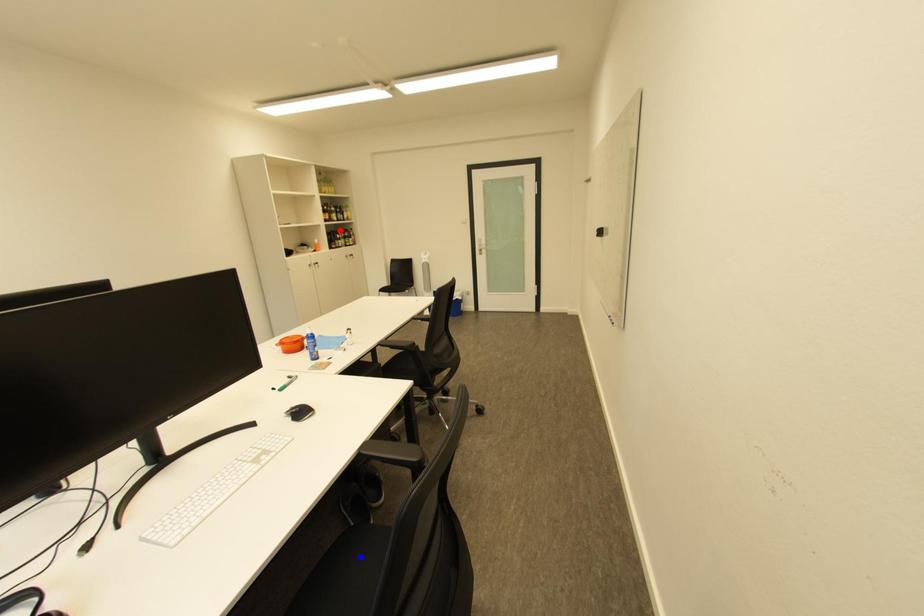
Question: Two points are marked on the image. Which point is closer to the camera?

Choices:
 (A) Blue point is closer.
 (B) Red point is closer.

Answer: (A)